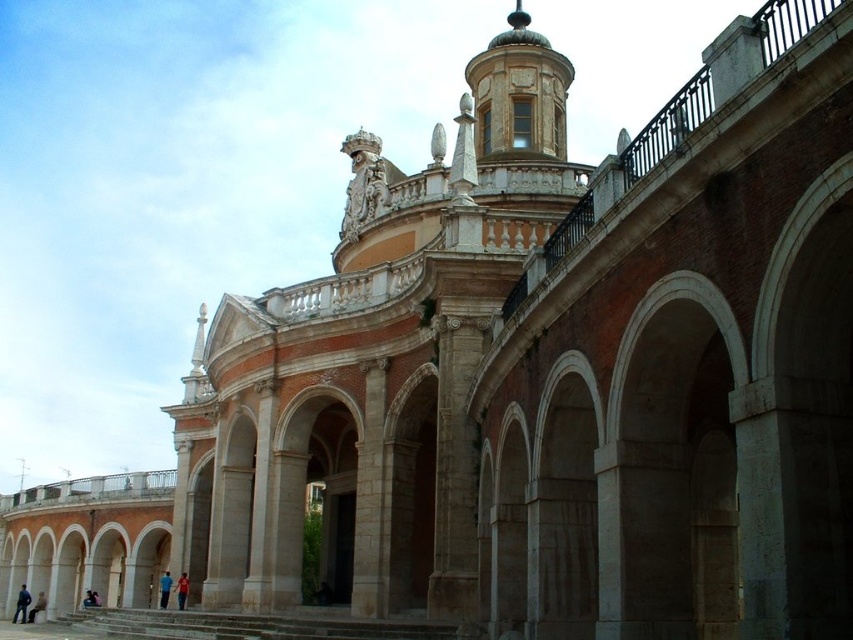
Question: Observing the image, what is the correct spatial positioning of blue denim jeans at lower left in reference to blue fabric person at lower center?

Choices:
 (A) below
 (B) above

Answer: (A)

Question: Which object is positioned closest to the blue fabric person at lower center?

Choices:
 (A) red shirt at lower center
 (B) blue denim jeans at lower left

Answer: (A)

Question: Among these objects, which one is farthest from the camera?

Choices:
 (A) blue denim jeans at lower left
 (B) blue fabric person at lower center

Answer: (A)

Question: Is blue fabric person at lower center wider than light brown leather jacket at lower left?

Choices:
 (A) yes
 (B) no

Answer: (A)

Question: Considering the relative positions of blue denim jeans at lower left and light brown leather jacket at lower left in the image provided, where is blue denim jeans at lower left located with respect to light brown leather jacket at lower left?

Choices:
 (A) below
 (B) above

Answer: (A)

Question: Among these objects, which one is nearest to the camera?

Choices:
 (A) blue denim jeans at lower left
 (B) light brown leather jacket at lower left

Answer: (B)